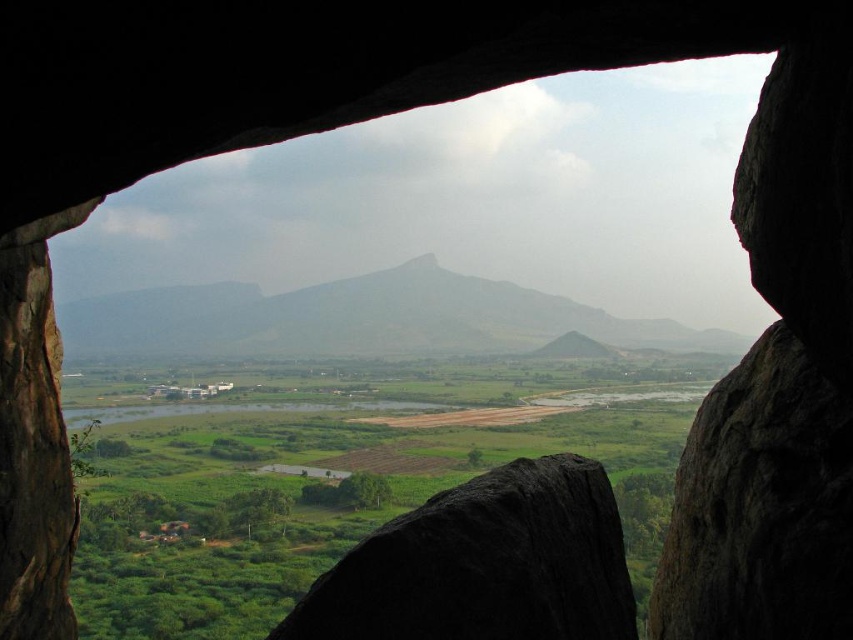
Is black rough rock at center wider than gray rock formation at center?

Incorrect, black rough rock at center's width does not surpass gray rock formation at center's.

Between black rough rock at center and gray rock formation at center, which one has more height?

gray rock formation at center

Find the location of a particular element. black rough rock at center is located at coordinates (485, 564).

At what (x,y) coordinates should I click in order to perform the action: click on black rough rock at center. Please return your answer as a coordinate pair (x, y). Looking at the image, I should click on (485, 564).

Who is positioned more to the left, dark gray rough rock at right or black rough rock at center?

black rough rock at center

Does point (828, 426) lie in front of point (506, 579)?

No, (828, 426) is behind (506, 579).

Between point (701, 412) and point (500, 604), which one is positioned in front?

Point (500, 604) is more forward.

Locate an element on the screen. This screenshot has height=640, width=853. dark gray rough rock at right is located at coordinates (761, 506).

This screenshot has width=853, height=640. What do you see at coordinates (761, 506) in the screenshot?
I see `dark gray rough rock at right` at bounding box center [761, 506].

Is dark gray rough rock at right further to camera compared to gray rock formation at center?

No, it is not.

Is point (746, 404) closer to viewer compared to point (469, 321)?

Yes, point (746, 404) is in front of point (469, 321).

Where is `dark gray rough rock at right`? dark gray rough rock at right is located at coordinates (761, 506).